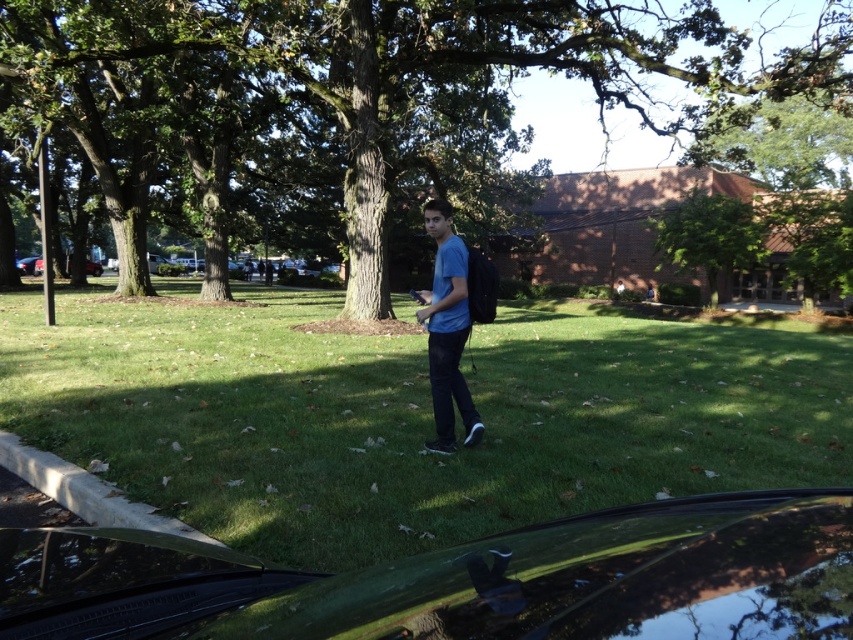
Question: Can you confirm if glossy black car at lower center is positioned to the right of blue matte shirt at center?

Choices:
 (A) no
 (B) yes

Answer: (A)

Question: Based on their relative distances, which object is farther from the green grass at center?

Choices:
 (A) green textured tree at center
 (B) blue matte shirt at center

Answer: (A)

Question: Based on their relative distances, which object is nearer to the glossy black car at lower center?

Choices:
 (A) green leafy tree at center
 (B) blue matte shirt at center
 (C) green textured tree at center
 (D) green grass at center

Answer: (B)

Question: Does green grass at center have a lesser width compared to blue matte shirt at center?

Choices:
 (A) no
 (B) yes

Answer: (A)

Question: Which object is the closest to the green grass at center?

Choices:
 (A) green leafy tree at center
 (B) glossy black car at lower center
 (C) blue matte shirt at center

Answer: (B)

Question: Is blue matte shirt at center bigger than green leafy tree at center?

Choices:
 (A) no
 (B) yes

Answer: (A)